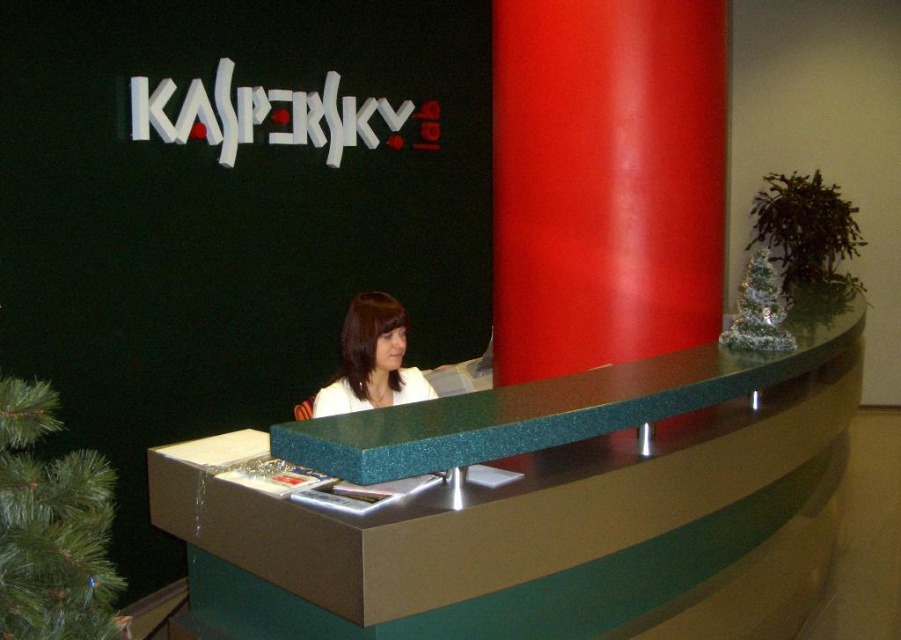
Question: Which point appears farthest from the camera in this image?

Choices:
 (A) (288, 595)
 (B) (567, 289)

Answer: (B)

Question: Which object is the farthest from the green speckled laminate desk at center?

Choices:
 (A) white matte jacket at center
 (B) red glossy pillar at center

Answer: (B)

Question: Is green speckled laminate desk at center bigger than red glossy pillar at center?

Choices:
 (A) no
 (B) yes

Answer: (B)

Question: Can you confirm if green speckled laminate desk at center is positioned to the left of white matte jacket at center?

Choices:
 (A) no
 (B) yes

Answer: (A)

Question: Considering the relative positions of green speckled laminate desk at center and white matte jacket at center in the image provided, where is green speckled laminate desk at center located with respect to white matte jacket at center?

Choices:
 (A) left
 (B) right

Answer: (B)

Question: Among these points, which one is nearest to the camera?

Choices:
 (A) (706, 113)
 (B) (405, 387)
 (C) (563, 538)

Answer: (C)